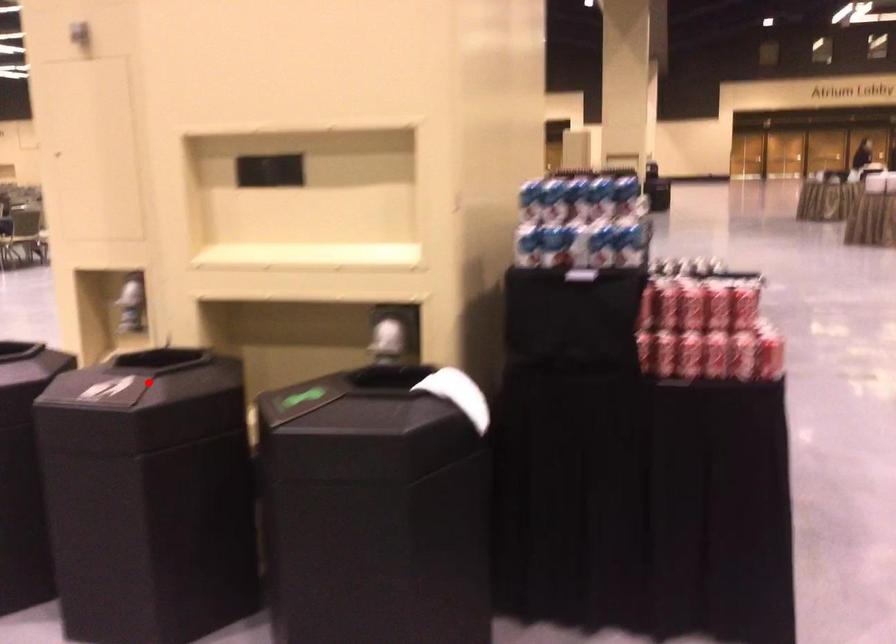
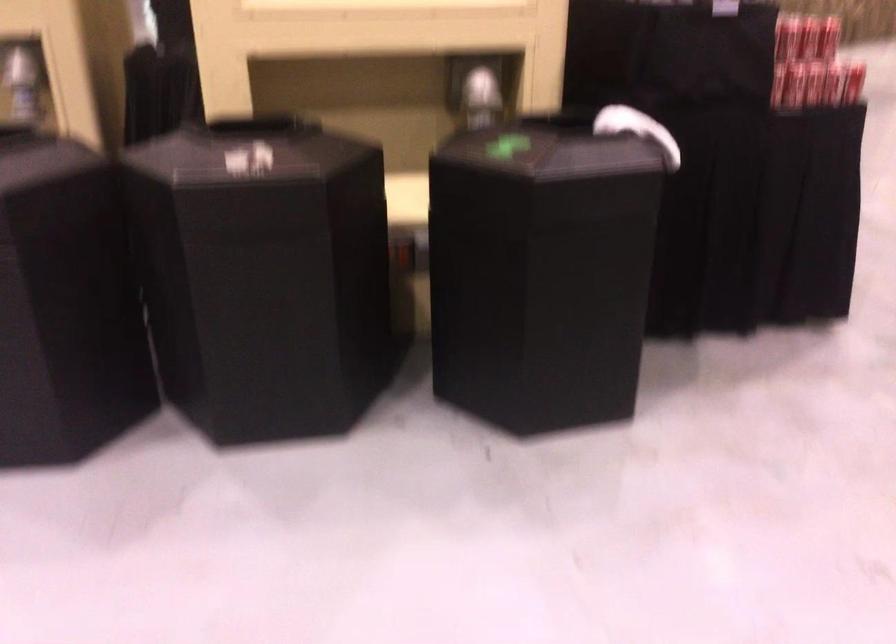
Question: I am providing you with two images of the same scene from different viewpoints. Image1 has a red point marked. In image2, the corresponding 3D location appears at what relative position? Reply with the corresponding letter.

Choices:
 (A) Closer
 (B) Farther

Answer: (A)